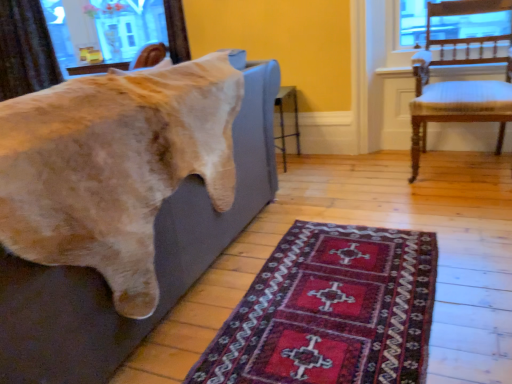
Locate an element on the screen. The image size is (512, 384). empty space that is to the right of dark red woven rug at lower center is located at coordinates (470, 248).